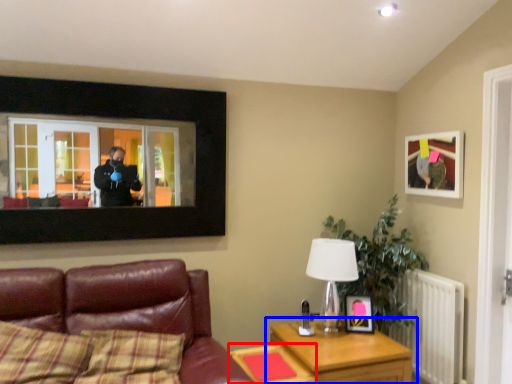
Question: Which of the following is the closest to the observer, table (highlighted by a red box) or table (highlighted by a blue box)?

Choices:
 (A) table
 (B) table

Answer: (A)